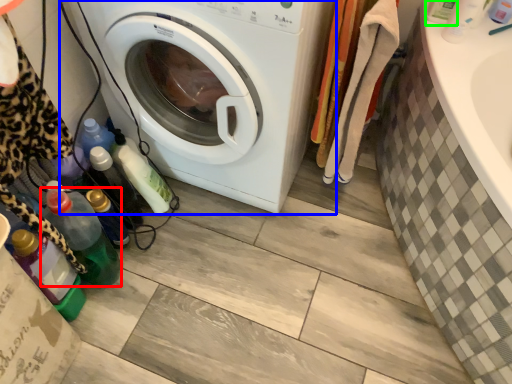
Question: Which is nearer to the bottle (highlighted by a red box)? washing machine (highlighted by a blue box) or bottle (highlighted by a green box).

Choices:
 (A) washing machine
 (B) bottle

Answer: (A)